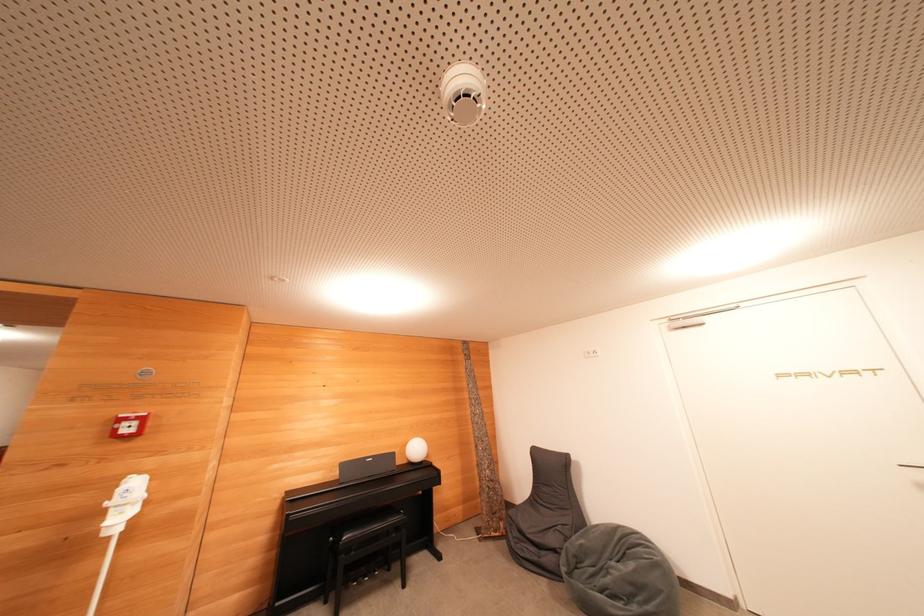
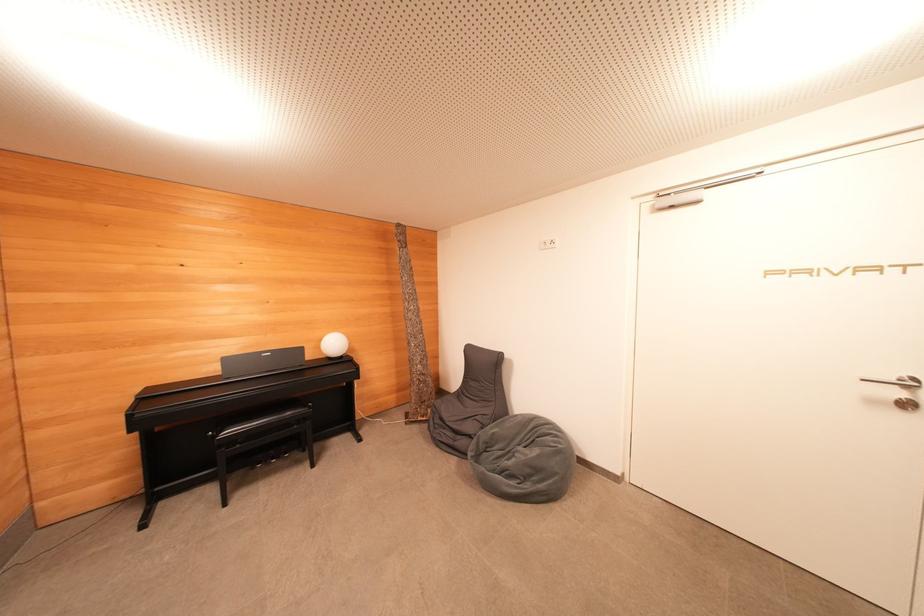
Where in the second image is the point corresponding to point (635, 569) from the first image?

(540, 455)